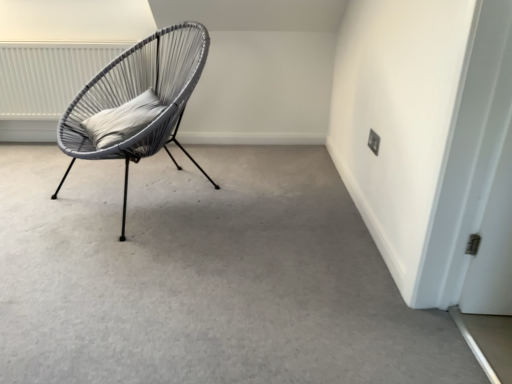
Question: Is matte grey wicker chair at left inside or outside of white soft cushion at center?

Choices:
 (A) outside
 (B) inside

Answer: (A)

Question: Does point (130, 139) appear closer or farther from the camera than point (136, 107)?

Choices:
 (A) farther
 (B) closer

Answer: (B)

Question: Which of these objects is positioned farthest from the matte gray carpet at center?

Choices:
 (A) white textured radiator at upper left
 (B) matte grey wicker chair at left
 (C) black plastic electric outlet at upper right
 (D) white soft cushion at center

Answer: (A)

Question: Estimate the real-world distances between objects in this image. Which object is closer to the matte gray carpet at center?

Choices:
 (A) white soft cushion at center
 (B) matte grey wicker chair at left
 (C) white textured radiator at upper left
 (D) black plastic electric outlet at upper right

Answer: (B)